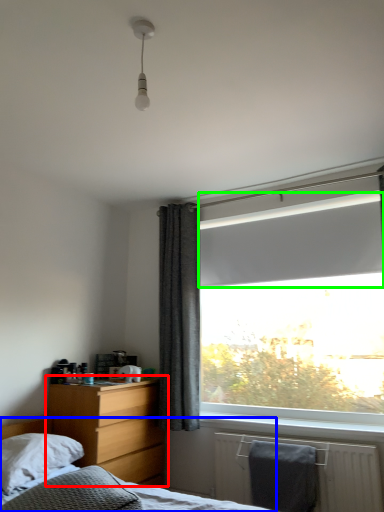
Question: Estimate the real-world distances between objects in this image. Which object is closer to nightstand (highlighted by a red box), bed (highlighted by a blue box) or window screen (highlighted by a green box)?

Choices:
 (A) bed
 (B) window screen

Answer: (A)